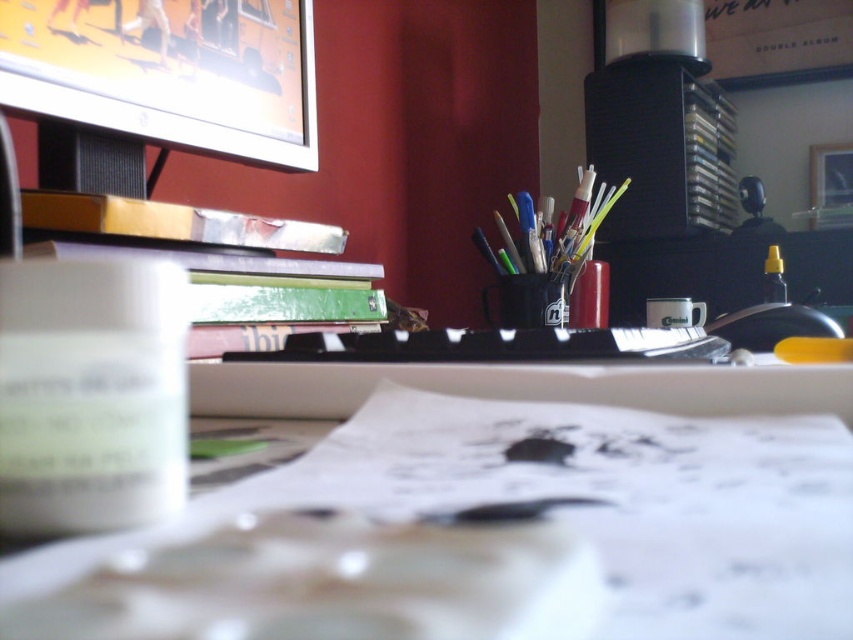
Question: Can you confirm if matte black cup at center is positioned to the left of metallic silver stapler at center?

Choices:
 (A) yes
 (B) no

Answer: (A)

Question: Which object is positioned farthest from the metallic silver stapler at center?

Choices:
 (A) matte silver monitor at upper left
 (B) white paper at center

Answer: (B)

Question: Is matte silver monitor at upper left below yellow translucent bottle at right?

Choices:
 (A) yes
 (B) no

Answer: (B)

Question: Which point is closer to the camera?

Choices:
 (A) matte black cup at center
 (B) yellow translucent bottle at right

Answer: (A)

Question: Is matte black cup at center smaller than metallic silver stapler at center?

Choices:
 (A) no
 (B) yes

Answer: (A)

Question: Which point appears farthest from the camera in this image?

Choices:
 (A) (786, 528)
 (B) (685, 321)

Answer: (B)